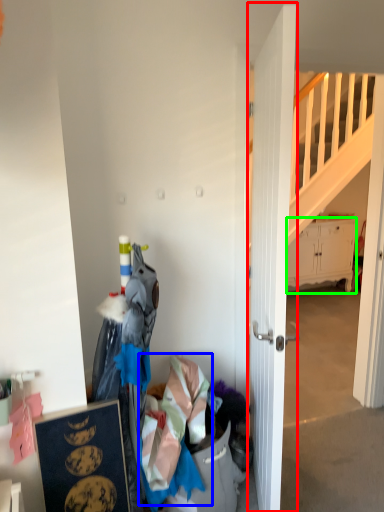
Question: Which object is the closest to the door (highlighted by a red box)? Choose among these: clothing (highlighted by a blue box) or cabinetry (highlighted by a green box).

Choices:
 (A) clothing
 (B) cabinetry

Answer: (A)